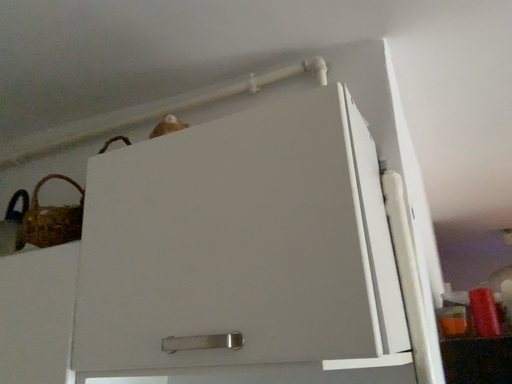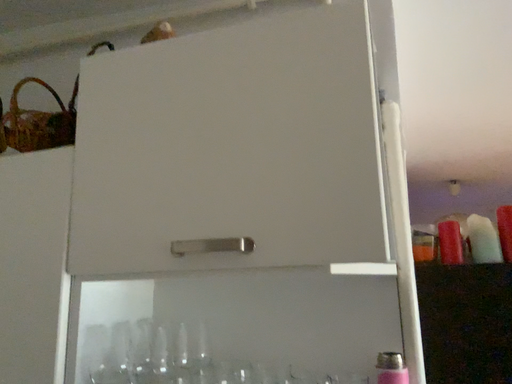
Question: Which way did the camera rotate in the video?

Choices:
 (A) rotated downward
 (B) rotated upward

Answer: (A)